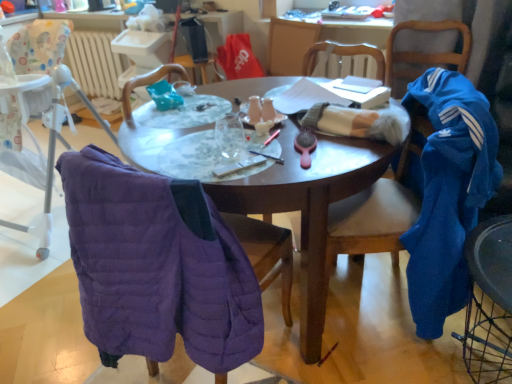
Question: Should I look upward or downward to see purple quilted jacket at left, the 4th chair in the right-to-left sequence?

Choices:
 (A) down
 (B) up

Answer: (A)

Question: Is matte black pen at center oriented towards blue fleece jacket at right, placed as the 1th chair when sorted from right to left?

Choices:
 (A) no
 (B) yes

Answer: (A)

Question: Considering the relative sizes of matte black pen at center and blue fleece jacket at right, placed as the 1th chair when sorted from right to left, in the image provided, is matte black pen at center bigger than blue fleece jacket at right, placed as the 1th chair when sorted from right to left,?

Choices:
 (A) no
 (B) yes

Answer: (A)

Question: From the image's perspective, is matte black pen at center located above blue fleece jacket at right, placed as the 1th chair when sorted from right to left?

Choices:
 (A) yes
 (B) no

Answer: (B)

Question: From a real-world perspective, does matte black pen at center stand above blue fleece jacket at right, placed as the 1th chair when sorted from right to left?

Choices:
 (A) yes
 (B) no

Answer: (A)

Question: Is matte black pen at center shorter than blue fleece jacket at right, the fifth chair in the left-to-right sequence?

Choices:
 (A) no
 (B) yes

Answer: (B)

Question: Considering the relative sizes of matte black pen at center and blue fleece jacket at right, the fifth chair in the left-to-right sequence, in the image provided, is matte black pen at center wider than blue fleece jacket at right, the fifth chair in the left-to-right sequence,?

Choices:
 (A) yes
 (B) no

Answer: (B)

Question: Does matte black pen at center have a lesser width compared to beige radiator at upper left?

Choices:
 (A) no
 (B) yes

Answer: (B)

Question: Can beige radiator at upper left be found inside matte black pen at center?

Choices:
 (A) no
 (B) yes

Answer: (A)

Question: Does matte black pen at center have a smaller size compared to beige radiator at upper left?

Choices:
 (A) yes
 (B) no

Answer: (A)

Question: Does matte black pen at center have a greater width compared to beige radiator at upper left?

Choices:
 (A) yes
 (B) no

Answer: (B)

Question: Is matte black pen at center behind beige radiator at upper left?

Choices:
 (A) yes
 (B) no

Answer: (B)

Question: Is matte black pen at center to the left of beige radiator at upper left from the viewer's perspective?

Choices:
 (A) yes
 (B) no

Answer: (B)

Question: From the image's perspective, is velvet blue chair at right, which ranks as the 2th chair in right-to-left order, on blue fleece jacket at right, positioned as the third chair in right-to-left order?

Choices:
 (A) no
 (B) yes

Answer: (A)